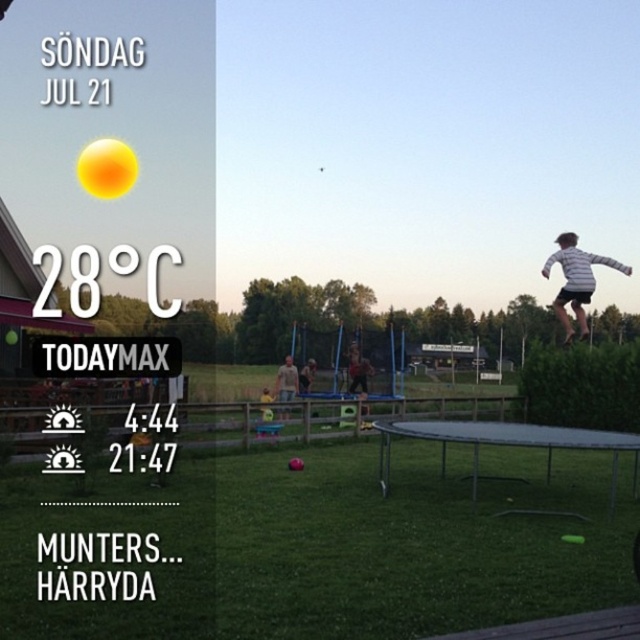
You are looking at an image divided into two parts. On the left is a weather forecast for Sunday, July 21, showing a sunny day with a high of 28 degrees Celsius. On the right is an outdoor scene. In the outdoor scene, there is a metallic trampoline at center and a striped cotton shirt at upper right. From the perspective of someone standing in the outdoor scene, which object is positioned to the left? Please respond with the object label exactly as provided in the Objects list.

The metallic trampoline at center is to the left of the striped cotton shirt at upper right.

You are planning to set up a picnic blanket between the metallic trampoline at center and the striped cotton shirt at upper right. If the picnic blanket requires 10 feet of space, will there be enough room?

The metallic trampoline at center and striped cotton shirt at upper right are 11.78 feet apart from each other, so yes, the picnic blanket requiring 10 feet of space will fit between them since the distance is sufficient.